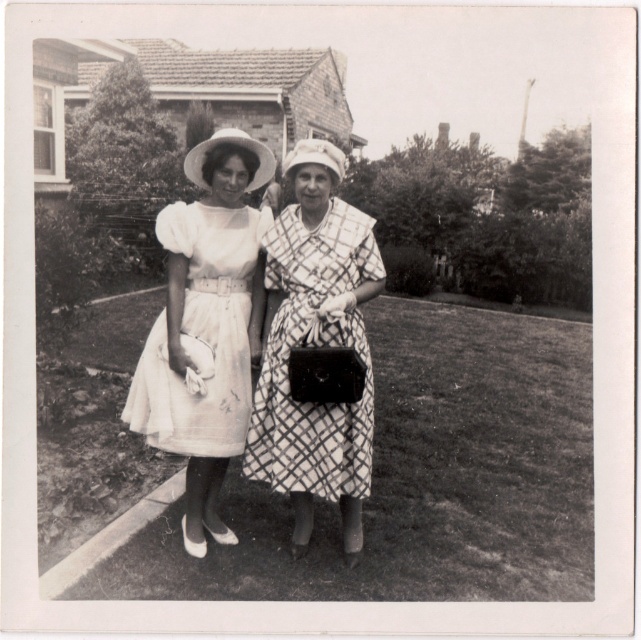
Question: Among these points, which one is farthest from the camera?

Choices:
 (A) (294, 444)
 (B) (247, 396)

Answer: (B)

Question: Can you confirm if patterned fabric dress at center is positioned above white tulle dress at center?

Choices:
 (A) yes
 (B) no

Answer: (B)

Question: Among these objects, which one is nearest to the camera?

Choices:
 (A) white tulle dress at center
 (B) patterned fabric dress at center

Answer: (B)

Question: Does patterned fabric dress at center have a smaller size compared to white tulle dress at center?

Choices:
 (A) yes
 (B) no

Answer: (B)

Question: Can you confirm if patterned fabric dress at center is smaller than white tulle dress at center?

Choices:
 (A) yes
 (B) no

Answer: (B)

Question: Which point is farther to the camera?

Choices:
 (A) (272, 282)
 (B) (151, 397)

Answer: (A)